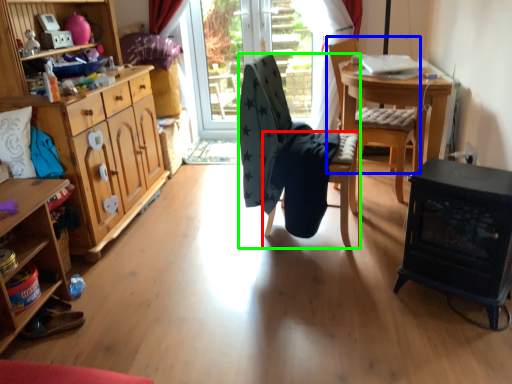
Question: Considering the real-world distances, which object is farthest from chair (highlighted by a red box)? chair (highlighted by a blue box) or chair (highlighted by a green box)?

Choices:
 (A) chair
 (B) chair

Answer: (A)